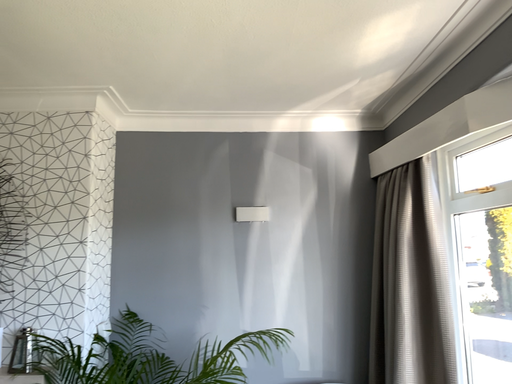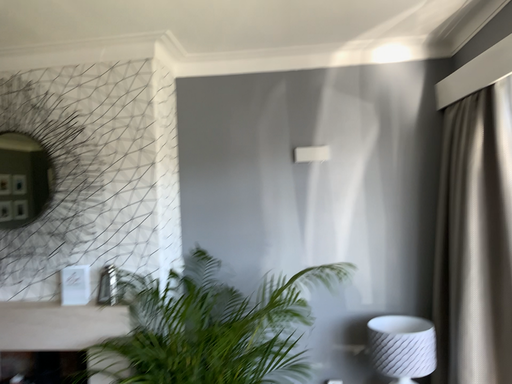
Question: How did the camera likely rotate when shooting the video?

Choices:
 (A) rotated upward
 (B) rotated downward

Answer: (B)